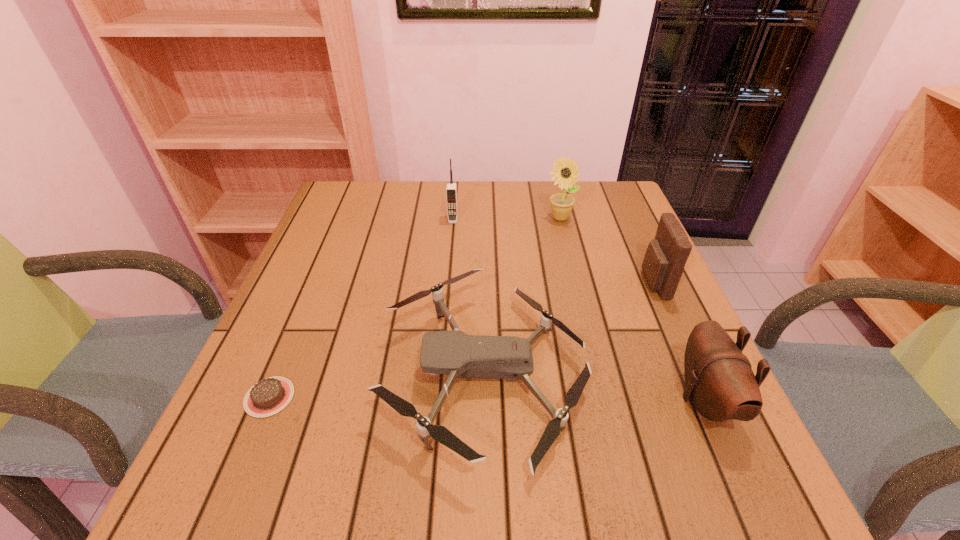
Where is `empty space between the shortest object and the nearer pouch`? The height and width of the screenshot is (540, 960). empty space between the shortest object and the nearer pouch is located at coordinates (488, 398).

Identify the location of vacant area that lies between the nearer pouch and the drone. The height and width of the screenshot is (540, 960). (594, 387).

The width and height of the screenshot is (960, 540). I want to click on free point between the nearer pouch and the farther pouch, so click(680, 341).

Locate an element on the screen. Image resolution: width=960 pixels, height=540 pixels. blank region between the fifth tallest object and the cellular telephone is located at coordinates (468, 297).

You are a GUI agent. You are given a task and a screenshot of the screen. Output one action in this format:
    pyautogui.click(x=<x>, y=<y>)
    Task: Click on the vacant area between the drone and the cellular telephone
    This screenshot has height=540, width=960.
    Given the screenshot: What is the action you would take?
    pyautogui.click(x=468, y=297)

Where is `vacant space in between the sunflower and the cellular telephone`? The height and width of the screenshot is (540, 960). vacant space in between the sunflower and the cellular telephone is located at coordinates (506, 219).

In order to click on vacant space in between the shortest object and the sunflower in this screenshot , I will do `click(415, 308)`.

Identify the location of free space between the leftmost object and the nearer pouch. (488, 398).

This screenshot has height=540, width=960. In order to click on object that is the third nearest to the farther pouch in this screenshot , I will do `click(565, 173)`.

Identify which object is located as the fourth nearest to the cellular telephone. Please provide its 2D coordinates. Your answer should be formatted as a tuple, i.e. [(x, y)], where the tuple contains the x and y coordinates of a point satisfying the conditions above.

[(269, 396)]